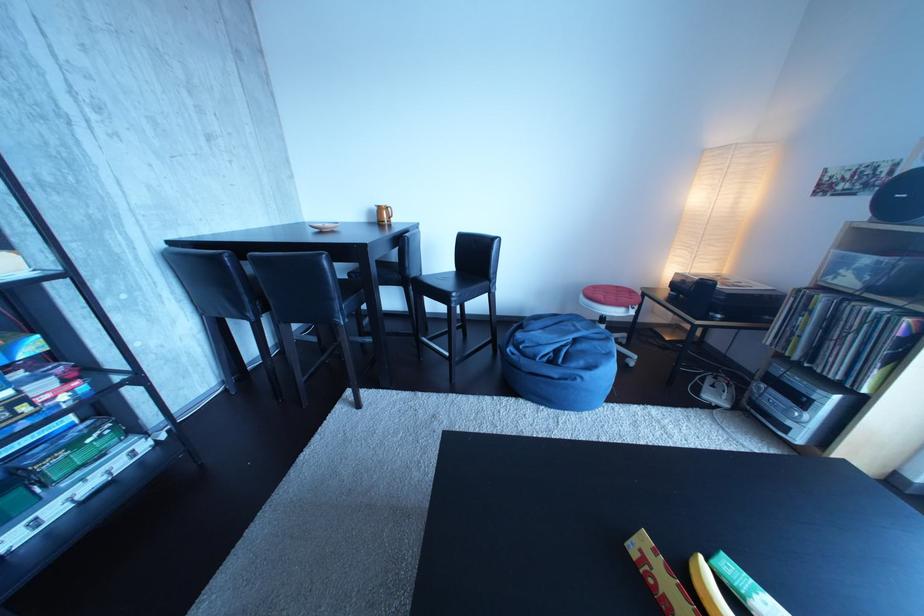
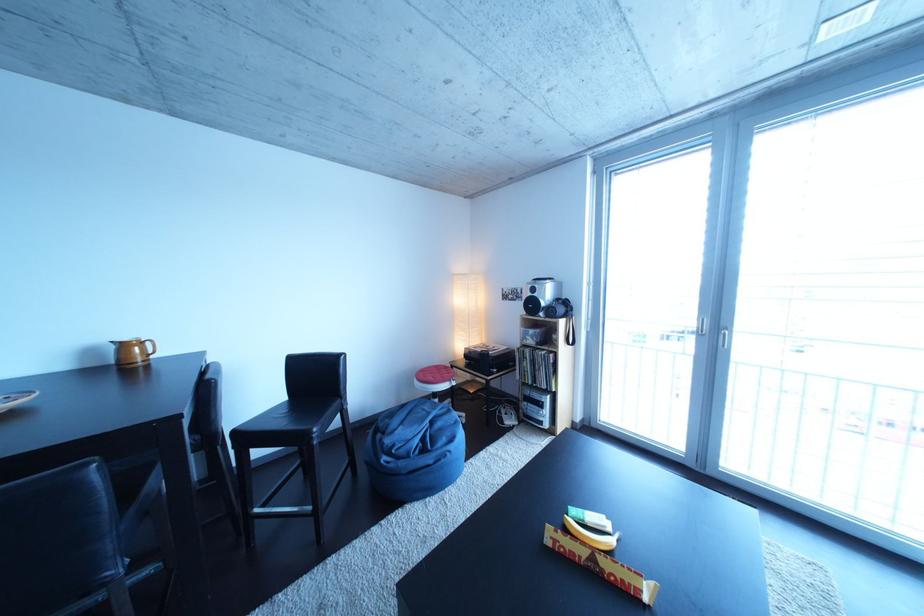
Locate, in the second image, the point that corresponds to the point at 589,346 in the first image.

(444, 428)